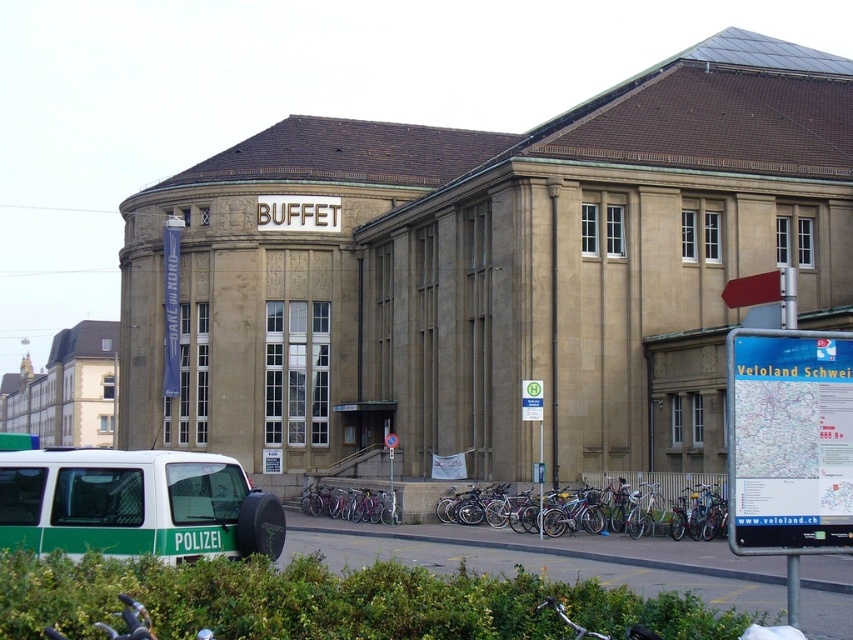
Measure the distance from green leafy bush at lower center to silver metallic bicycle at center.

green leafy bush at lower center and silver metallic bicycle at center are 26.97 meters apart from each other.

Is point (322, 616) positioned before point (483, 515)?

That is True.

Does point (413, 592) lie behind point (596, 493)?

No.

Where is `green leafy bush at lower center`? This screenshot has height=640, width=853. green leafy bush at lower center is located at coordinates (334, 602).

Does silver metallic bicycle at center appear on the right side of purple metallic bicycle at center?

Correct, you'll find silver metallic bicycle at center to the right of purple metallic bicycle at center.

Does silver metallic bicycle at center have a lesser height compared to purple metallic bicycle at center?

In fact, silver metallic bicycle at center may be taller than purple metallic bicycle at center.

What do you see at coordinates (651, 496) in the screenshot? Image resolution: width=853 pixels, height=640 pixels. I see `silver metallic bicycle at center` at bounding box center [651, 496].

Identify the location of silver metallic bicycle at center. This screenshot has height=640, width=853. (651, 496).

Between green matte van at lower left and silver metallic bicycle at center, which one is positioned higher?

Positioned higher is green matte van at lower left.

Looking at this image, does green matte van at lower left appear under silver metallic bicycle at center?

No.

The width and height of the screenshot is (853, 640). What are the coordinates of `green matte van at lower left` in the screenshot? It's located at (134, 504).